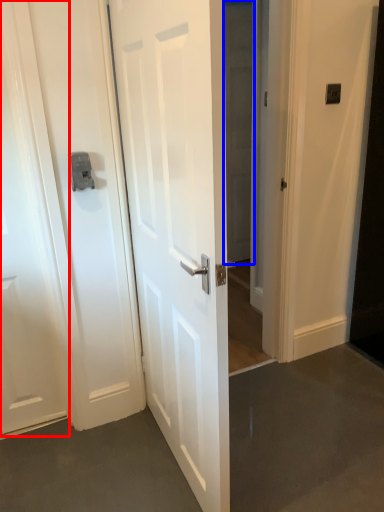
Question: Which of the following is the closest to the observer, door (highlighted by a red box) or glass door (highlighted by a blue box)?

Choices:
 (A) door
 (B) glass door

Answer: (A)